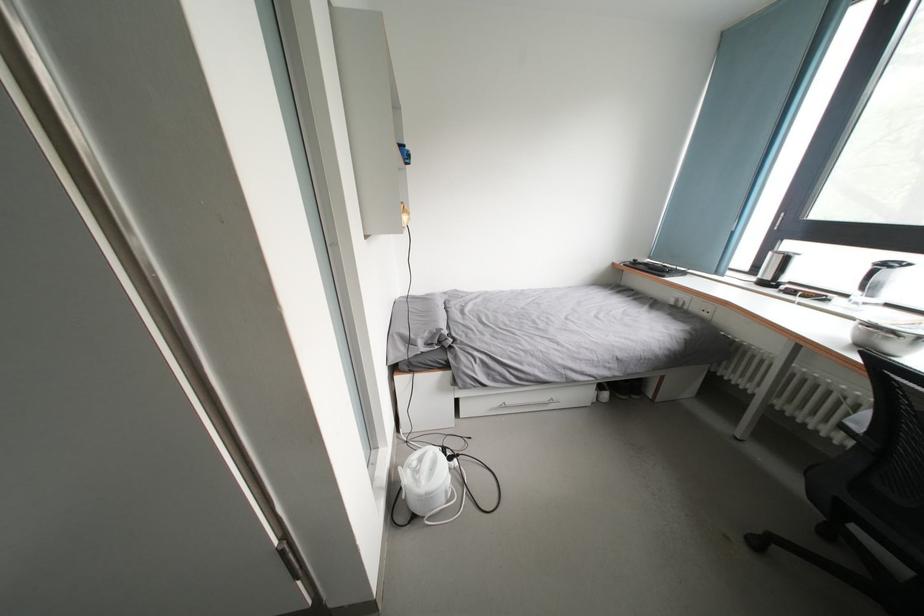
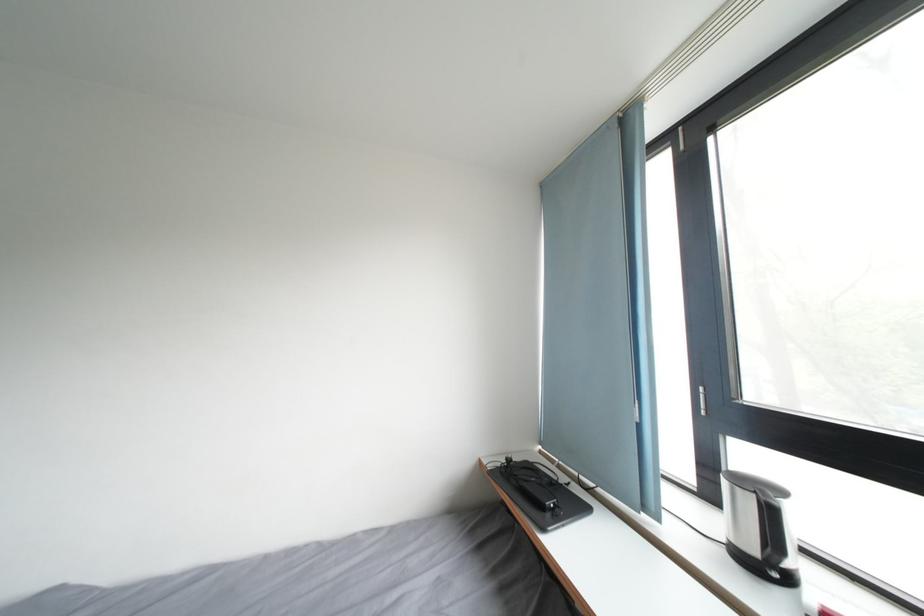
Find the pixel in the second image that matches [723,278] in the first image.

(651, 514)